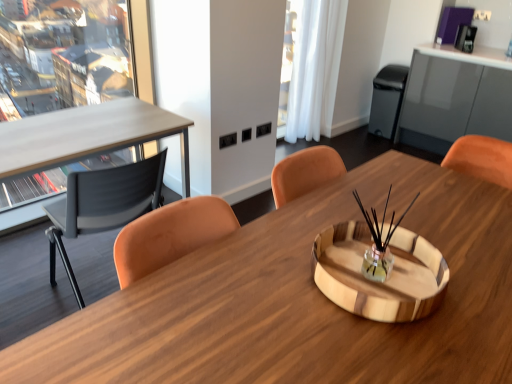
Question: Based on their positions, is black matte trash bin/can at right located to the left or right of white sheer curtain at upper right?

Choices:
 (A) right
 (B) left

Answer: (A)

Question: Considering the positions of black matte trash bin/can at right and white sheer curtain at upper right in the image, is black matte trash bin/can at right bigger or smaller than white sheer curtain at upper right?

Choices:
 (A) big
 (B) small

Answer: (B)

Question: Estimate the real-world distances between objects in this image. Which object is farther from the white sheer curtain at upper right?

Choices:
 (A) black matte trash bin/can at right
 (B) wooden desk at center
 (C) matte black chair at left

Answer: (B)

Question: Estimate the real-world distances between objects in this image. Which object is farther from the white sheer curtain at upper right?

Choices:
 (A) wooden desk at center
 (B) matte black chair at left
 (C) black matte trash bin/can at right

Answer: (A)